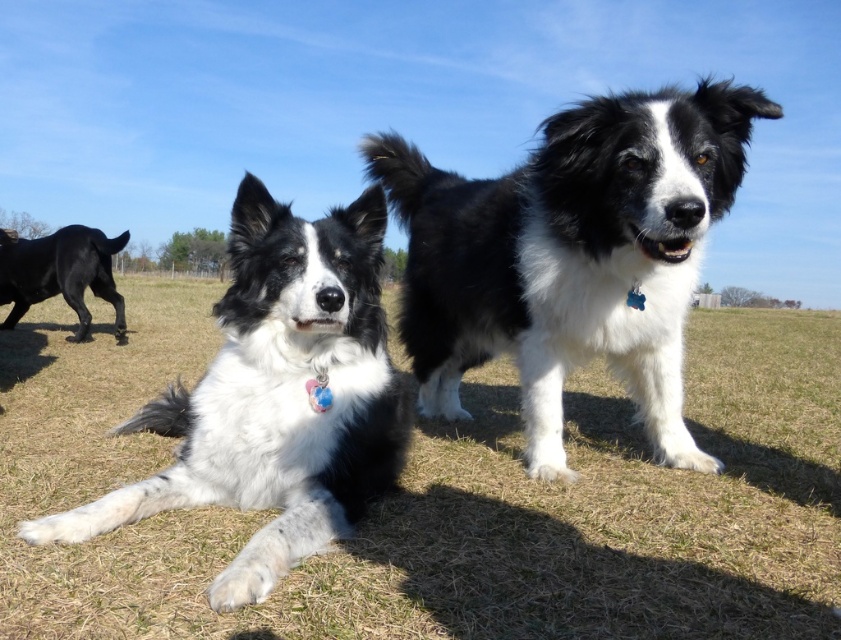
Looking at this image, you are a photographer setting up a tripod to capture the two dogs in the scene. You want to position the tripod so that both the black and white fur dog at center and the black glossy dog at left are visible in the frame. Based on their positions, which dog should you place closer to the left side of the tripod to ensure both are in the shot?

The black glossy dog at left is positioned to the left of the black and white fur dog at center. To include both in the frame, position the tripod so that the black glossy dog at left is closer to the left side of the tripod, allowing the black and white fur dog at center to be on the right side within the frame.

Consider the image. You are a photographer trying to capture a clear shot of both the black and white fur at center and the black and white fur dog at center. Which one will appear closer to you in the photo?

The black and white fur at center will appear closer to you in the photo because it is further to the viewer than the black and white fur dog at center.